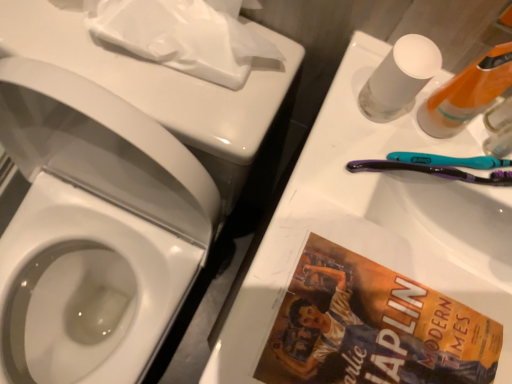
The image size is (512, 384). In order to click on vacant area that is in front of transparent plastic mouthwash at upper right, which is the second mouthwash in right-to-left order in this screenshot , I will do `click(350, 259)`.